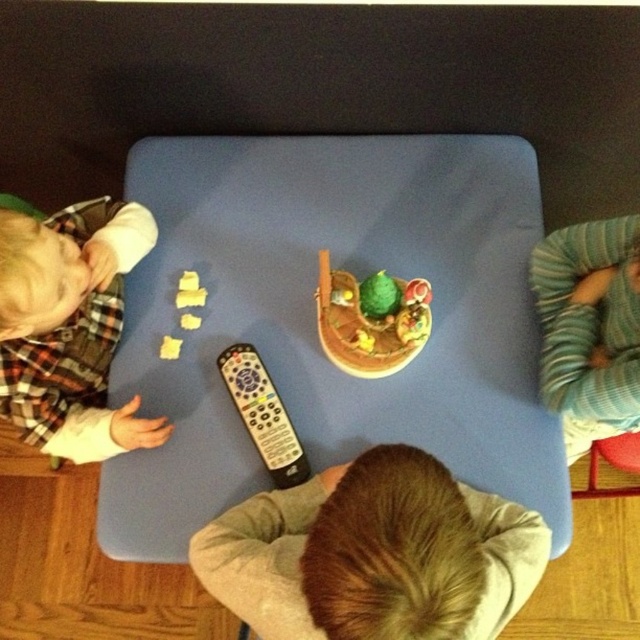
Consider the image. You are a parent observing your children playing at the table. You notice the blue fabric table at center and the flannel shirt at left. Which object is closer to you?

The flannel shirt at left is closer to you because it is positioned above the blue fabric table at center.

You are a parent trying to tidy up the table. You see the blonde hair at center and the smooth wooden bowl at center. Which item should you move first if you want to place them both to the right side of the table?

You should move the blonde hair at center first because it is already positioned to the left of the smooth wooden bowl at center, so moving it first would allow you to place it closer to the desired right side without blocking the bowl.